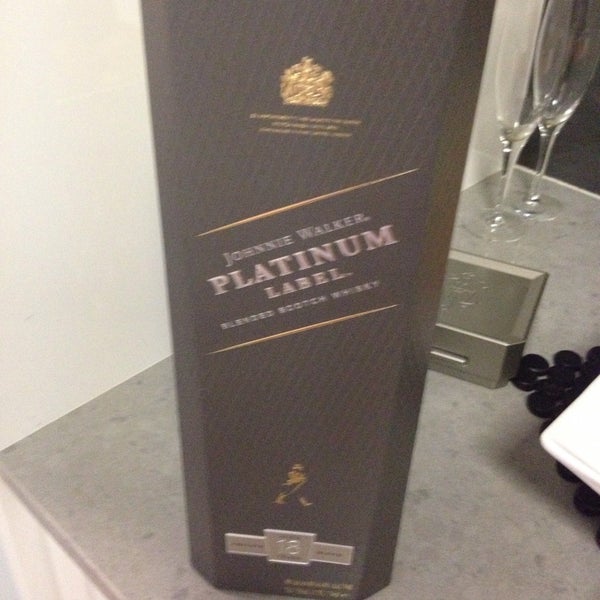
Find the location of `whiskey box`. whiskey box is located at coordinates (194, 552), (361, 576), (389, 427), (171, 200), (266, 68), (439, 49), (325, 280), (443, 206), (315, 444).